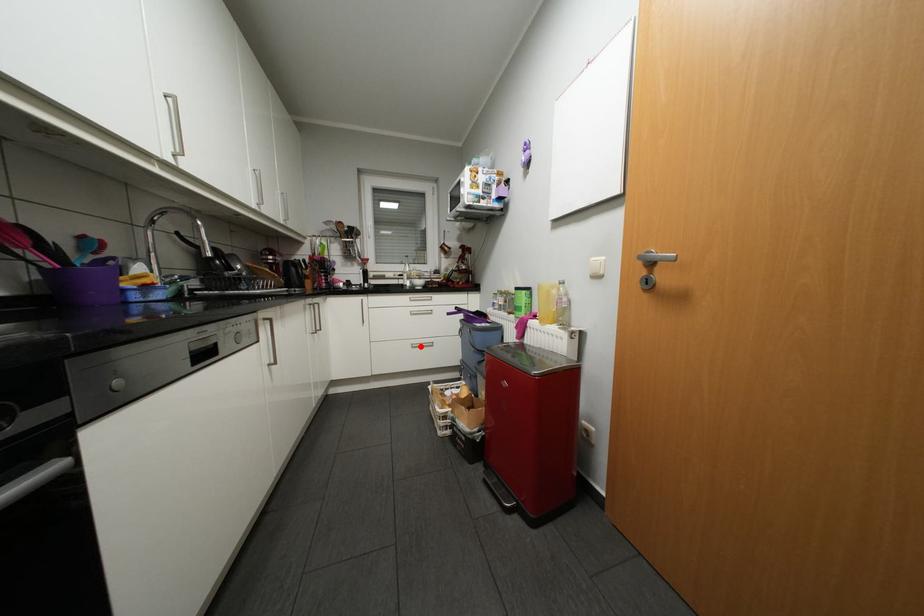
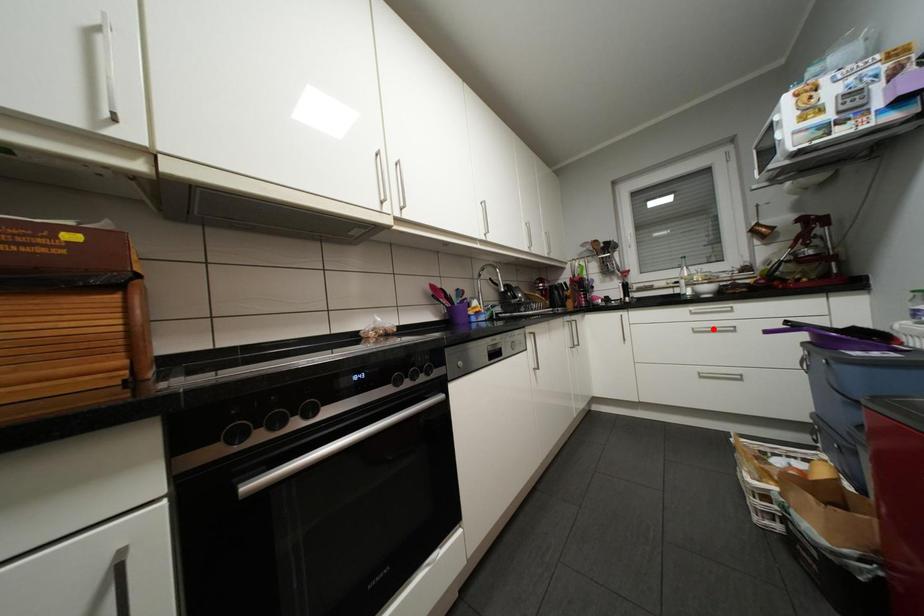
I am providing you with two images of the same scene from different viewpoints. A red point is marked on the first image and another point is marked on the second image. Does the point marked in image1 correspond to the same location as the one in image2?

No